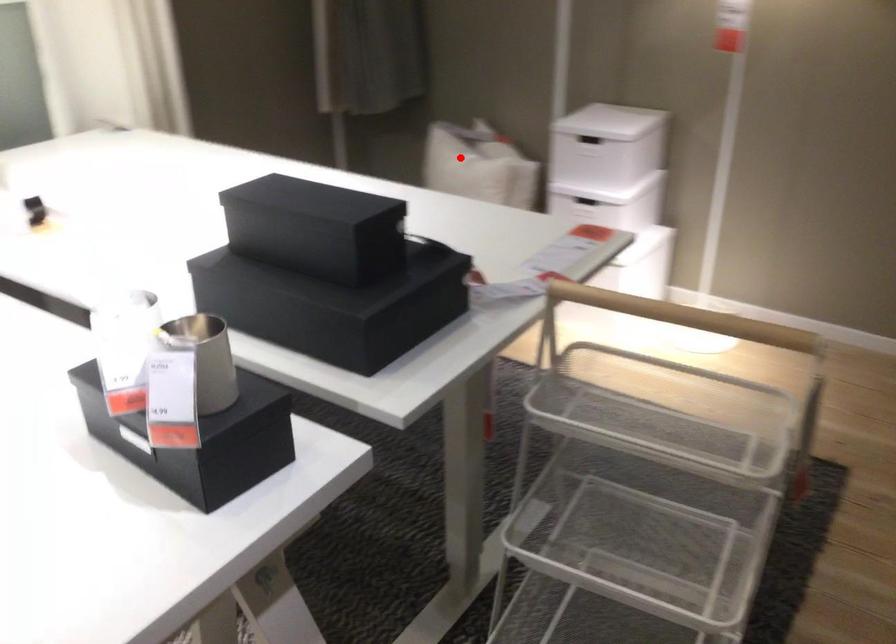
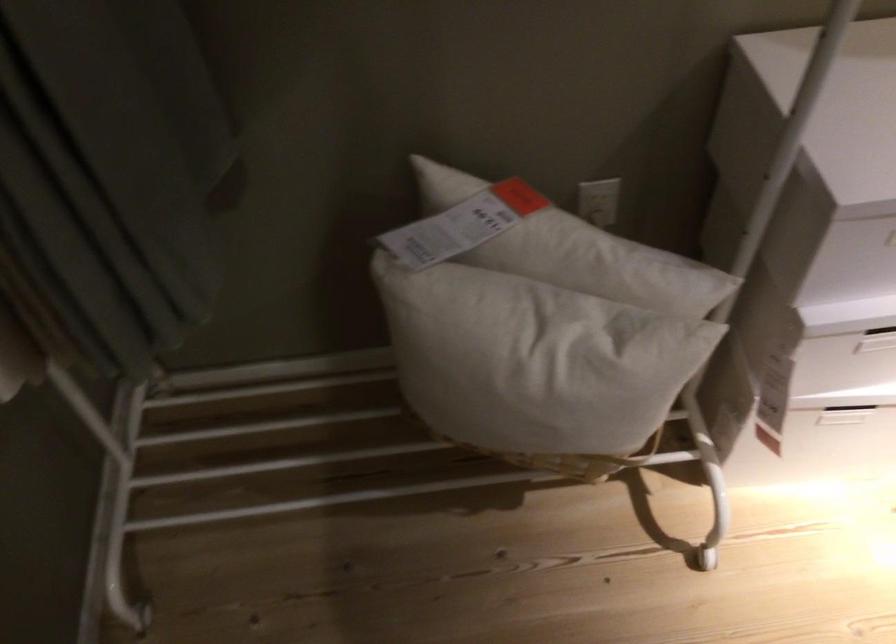
Locate, in the second image, the point that corresponds to the highlighted location in the first image.

(538, 363)